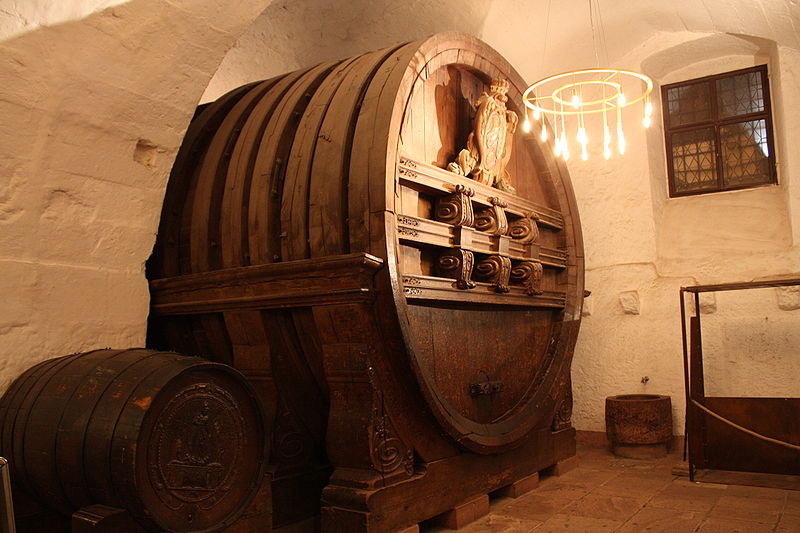
The height and width of the screenshot is (533, 800). What are the coordinates of `floor` in the screenshot? It's located at (613, 516).